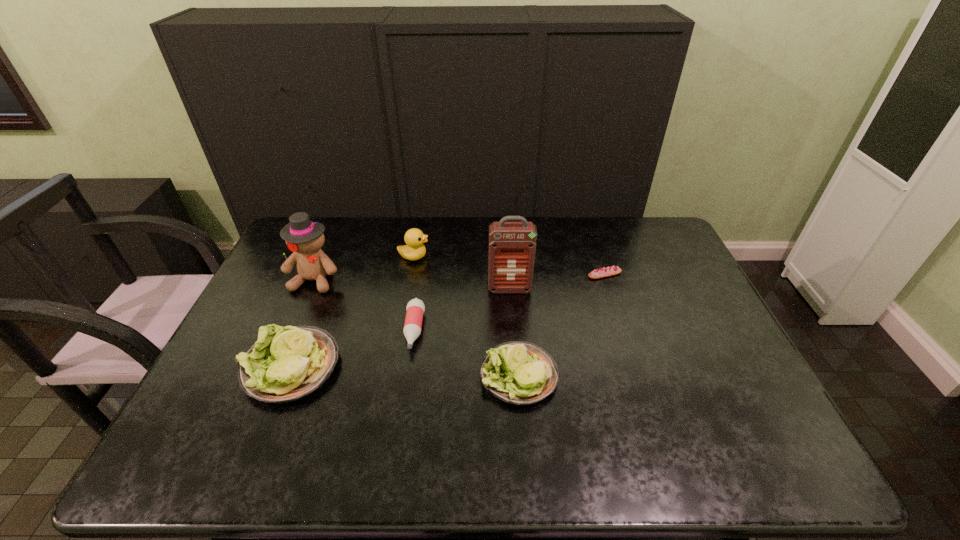
Where is `empty space that is in between the bottle and the rightmost object`? empty space that is in between the bottle and the rightmost object is located at coordinates (510, 302).

Find the location of `empty location between the first-aid kit and the left lettuce`. empty location between the first-aid kit and the left lettuce is located at coordinates (400, 328).

Identify the location of free space between the sixth shortest object and the taller lettuce. The height and width of the screenshot is (540, 960). (302, 323).

Find the location of `free space between the tallest object and the left lettuce`. free space between the tallest object and the left lettuce is located at coordinates pyautogui.click(x=400, y=328).

You are a GUI agent. You are given a task and a screenshot of the screen. Output one action in this format:
    pyautogui.click(x=<x>, y=<y>)
    Task: Click on the vacant region between the sixth tallest object and the tallest object
    The image size is (960, 540).
    Given the screenshot: What is the action you would take?
    pyautogui.click(x=462, y=309)

What are the coordinates of `unoccupied position between the sixth tallest object and the first-aid kit` in the screenshot? It's located at (462, 309).

This screenshot has height=540, width=960. Identify the location of vacant space that is in between the taller lettuce and the third shortest object. (404, 371).

Image resolution: width=960 pixels, height=540 pixels. What are the coordinates of `the fourth closest object to the bottle` in the screenshot? It's located at (414, 238).

Where is `the closest object relative to the farthest object`? the closest object relative to the farthest object is located at coordinates (304, 238).

You are a GUI agent. You are given a task and a screenshot of the screen. Output one action in this format:
    pyautogui.click(x=<x>, y=<y>)
    Task: Click on the vacant area in the image that satisfies the following two spatial constraints: 1. on the front-facing side of the left lettuce; 2. on the right side of the rag_doll
    The image size is (960, 540).
    Given the screenshot: What is the action you would take?
    pyautogui.click(x=277, y=367)